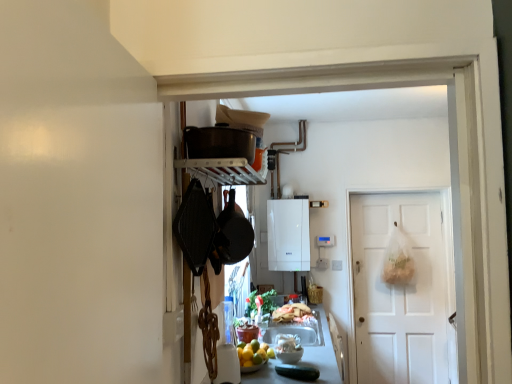
Question: From the image's perspective, is white glossy bowl at center, which is counted as the 2th food, starting from the back, on smooth gray countertop at center?

Choices:
 (A) yes
 (B) no

Answer: (A)

Question: Is white glossy bowl at center, marked as the first food in a front-to-back arrangement, wider than smooth gray countertop at center?

Choices:
 (A) no
 (B) yes

Answer: (A)

Question: From a real-world perspective, is white glossy bowl at center, marked as the first food in a front-to-back arrangement, under smooth gray countertop at center?

Choices:
 (A) no
 (B) yes

Answer: (A)

Question: Is smooth gray countertop at center at the back of white glossy bowl at center, marked as the first food in a front-to-back arrangement?

Choices:
 (A) yes
 (B) no

Answer: (B)

Question: Is white glossy bowl at center, marked as the first food in a front-to-back arrangement, taller than smooth gray countertop at center?

Choices:
 (A) yes
 (B) no

Answer: (B)

Question: In terms of height, does white matte door at center look taller or shorter compared to white glossy bowl at center, marked as the first food in a front-to-back arrangement?

Choices:
 (A) tall
 (B) short

Answer: (A)

Question: In the image, is white matte door at center positioned in front of or behind white glossy bowl at center, marked as the first food in a front-to-back arrangement?

Choices:
 (A) behind
 (B) front

Answer: (A)

Question: Is white matte door at center wider or thinner than white glossy bowl at center, marked as the first food in a front-to-back arrangement?

Choices:
 (A) wide
 (B) thin

Answer: (A)

Question: From a real-world perspective, is white matte door at center physically located above or below white glossy bowl at center, marked as the first food in a front-to-back arrangement?

Choices:
 (A) above
 (B) below

Answer: (A)

Question: From a real-world perspective, is white glossy bowl at center, which is counted as the 2th food, starting from the back, physically located above or below matte black pot at upper center, the second appliance when ordered from right to left?

Choices:
 (A) above
 (B) below

Answer: (B)

Question: In terms of width, does white glossy bowl at center, which is counted as the 2th food, starting from the back, look wider or thinner when compared to matte black pot at upper center, the 2th appliance in the bottom-to-top sequence?

Choices:
 (A) thin
 (B) wide

Answer: (A)

Question: From the image's perspective, relative to matte black pot at upper center, placed as the first appliance when sorted from front to back, is white glossy bowl at center, marked as the first food in a front-to-back arrangement, above or below?

Choices:
 (A) below
 (B) above

Answer: (A)

Question: Is white glossy bowl at center, which is counted as the 2th food, starting from the back, inside or outside of matte black pot at upper center, arranged as the first appliance when viewed from the left?

Choices:
 (A) outside
 (B) inside

Answer: (A)

Question: Considering the positions of point (219, 127) and point (274, 218), is point (219, 127) closer or farther from the camera than point (274, 218)?

Choices:
 (A) farther
 (B) closer

Answer: (B)

Question: Looking at the image, does matte black pot at upper center, placed as the first appliance when sorted from front to back, seem bigger or smaller compared to white glossy boiler at center, marked as the 2th appliance in a left-to-right arrangement?

Choices:
 (A) big
 (B) small

Answer: (B)